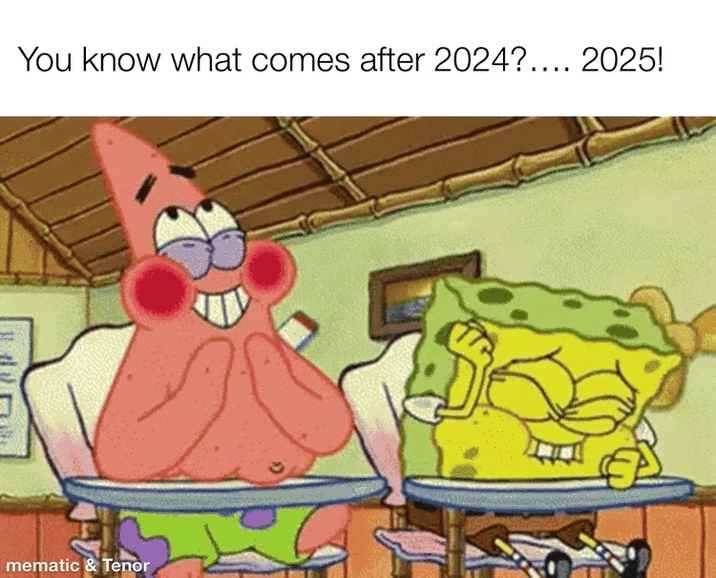
Locate an element on the screen. wood roof is located at coordinates (359, 136), (256, 166).